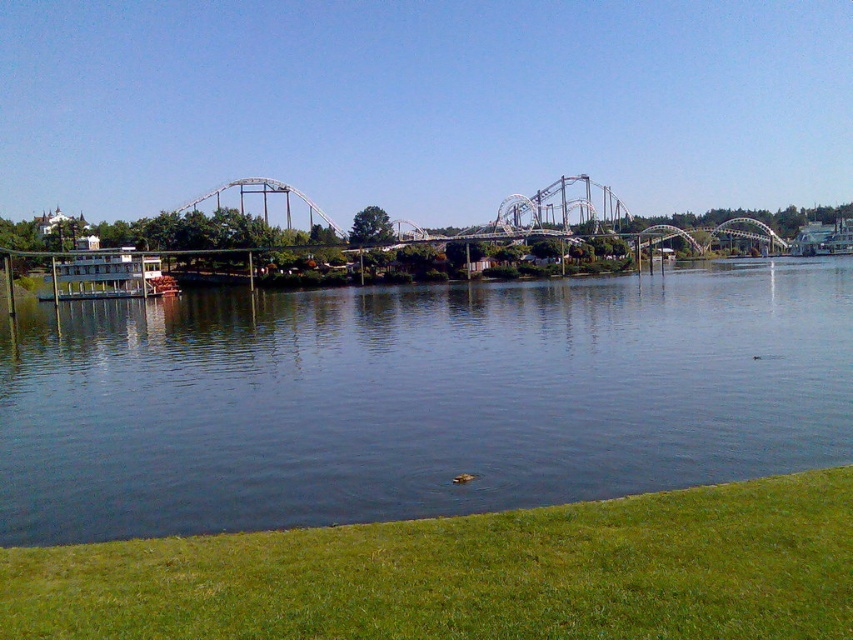
Question: Which point is closer to the camera?

Choices:
 (A) (57, 243)
 (B) (144, 275)
 (C) (57, 392)

Answer: (C)

Question: Can you confirm if dark blue water at center is positioned above metallic gray boat at center-left?

Choices:
 (A) no
 (B) yes

Answer: (A)

Question: Observing the image, what is the correct spatial positioning of dark blue water at center in reference to green grass at lower right?

Choices:
 (A) right
 (B) left

Answer: (A)

Question: Which object is the closest to the green grass at lower right?

Choices:
 (A) metallic gray boat at center-left
 (B) dark blue water at center
 (C) white matte roller coaster at upper center

Answer: (B)

Question: Which point is closer to the camera?

Choices:
 (A) green grass at lower right
 (B) dark blue water at center
 (C) white matte roller coaster at upper center
 (D) metallic gray boat at center-left

Answer: (A)

Question: Can you confirm if dark blue water at center is positioned to the left of green grass at lower right?

Choices:
 (A) no
 (B) yes

Answer: (A)